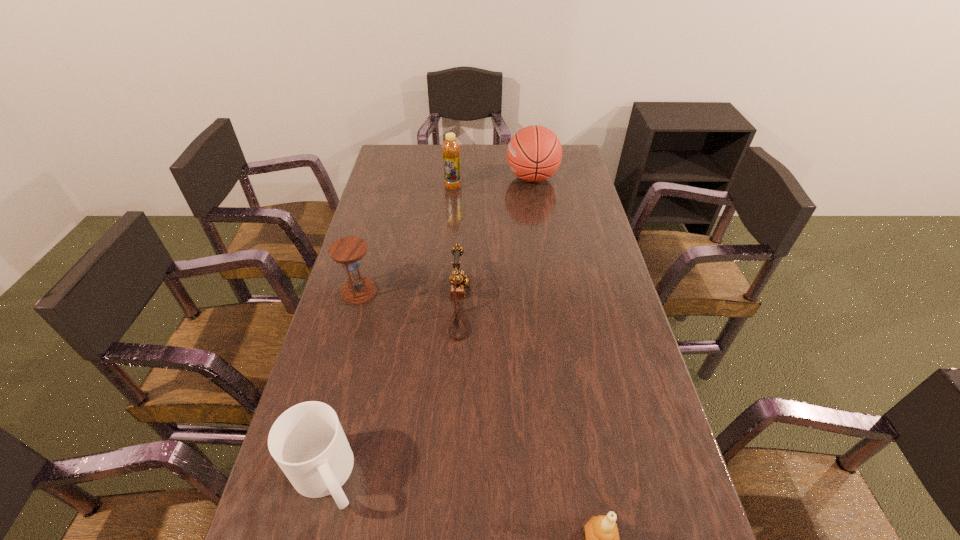
You are a GUI agent. You are given a task and a screenshot of the screen. Output one action in this format:
    pyautogui.click(x=<x>, y=<y>)
    Task: Click on the bottle
    The height and width of the screenshot is (540, 960).
    Given the screenshot: What is the action you would take?
    pyautogui.click(x=450, y=148)

Locate an element on the screen. basketball is located at coordinates (534, 153).

Locate an element on the screen. hourglass is located at coordinates (348, 251).

The image size is (960, 540). I want to click on mug, so click(307, 441).

Locate an element on the screen. The width and height of the screenshot is (960, 540). telephone is located at coordinates click(458, 279).

The width and height of the screenshot is (960, 540). I want to click on vacant space positioned on the front of the bottle, so click(x=450, y=221).

This screenshot has width=960, height=540. Identify the location of vacant space located on the logo side of the basketball. (x=416, y=178).

What are the coordinates of `vacant space located 0.120m on the logo side of the basketball` in the screenshot? It's located at (476, 178).

Identify the location of vacant space situated on the logo side of the basketball. point(431,178).

Image resolution: width=960 pixels, height=540 pixels. Find the location of `free point located on the back of the hourglass`. free point located on the back of the hourglass is located at coordinates (377, 226).